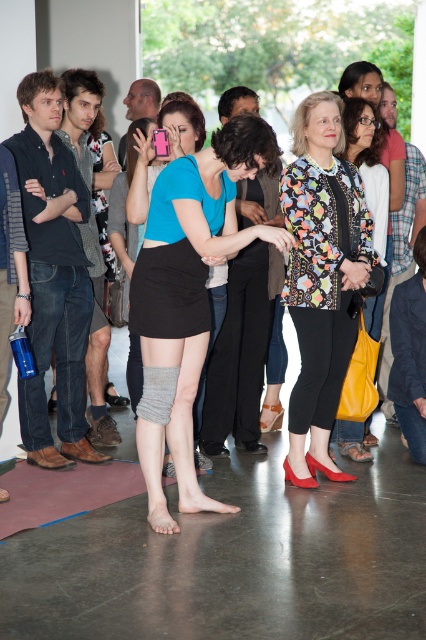
Can you confirm if gray knit knee-high socks at center is positioned to the left of printed fabric jacket at center?

Indeed, gray knit knee-high socks at center is positioned on the left side of printed fabric jacket at center.

Is point (204, 499) positioned before point (305, 188)?

Yes, point (204, 499) is closer to viewer.

Identify the location of gray knit knee-high socks at center. (187, 296).

Is gray knit knee-high socks at center above matte black skirt at center?

Yes, gray knit knee-high socks at center is above matte black skirt at center.

Is gray knit knee-high socks at center shorter than matte black skirt at center?

No.

Is point (218, 195) less distant than point (117, 497)?

Yes, it is in front of point (117, 497).

Image resolution: width=426 pixels, height=640 pixels. I want to click on gray knit knee-high socks at center, so pyautogui.click(x=187, y=296).

Is printed fabric jacket at center closer to camera compared to matte black skirt at center?

No, it is behind matte black skirt at center.

Can you confirm if printed fabric jacket at center is wider than matte black skirt at center?

No, printed fabric jacket at center is not wider than matte black skirt at center.

Between point (339, 150) and point (78, 483), which one is positioned in front?

Point (339, 150)

Locate an element on the screen. printed fabric jacket at center is located at coordinates (322, 276).